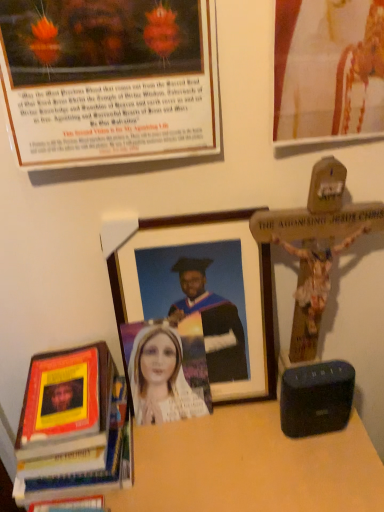
Locate an element on the screen. empty space that is ontop of hardcover book at lower left is located at coordinates (65, 381).